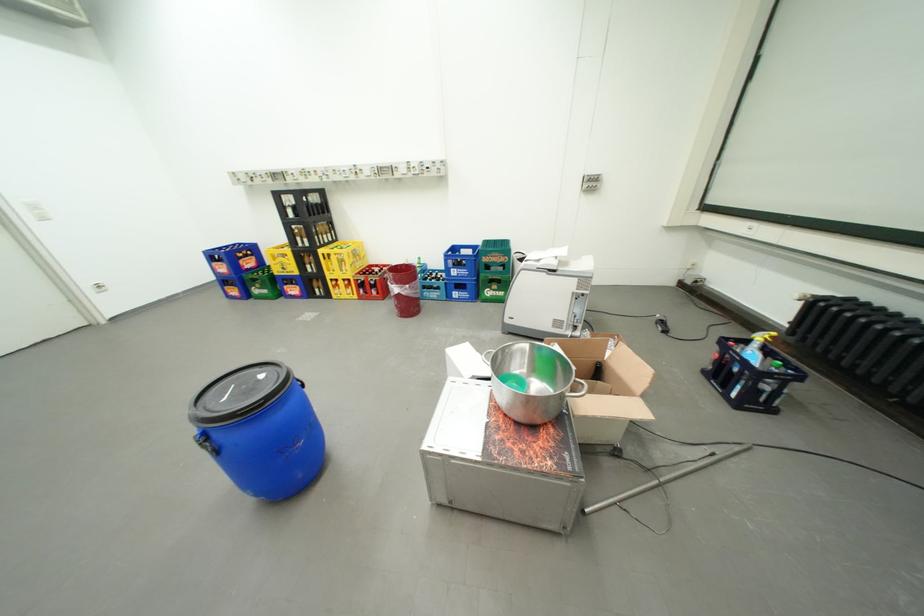
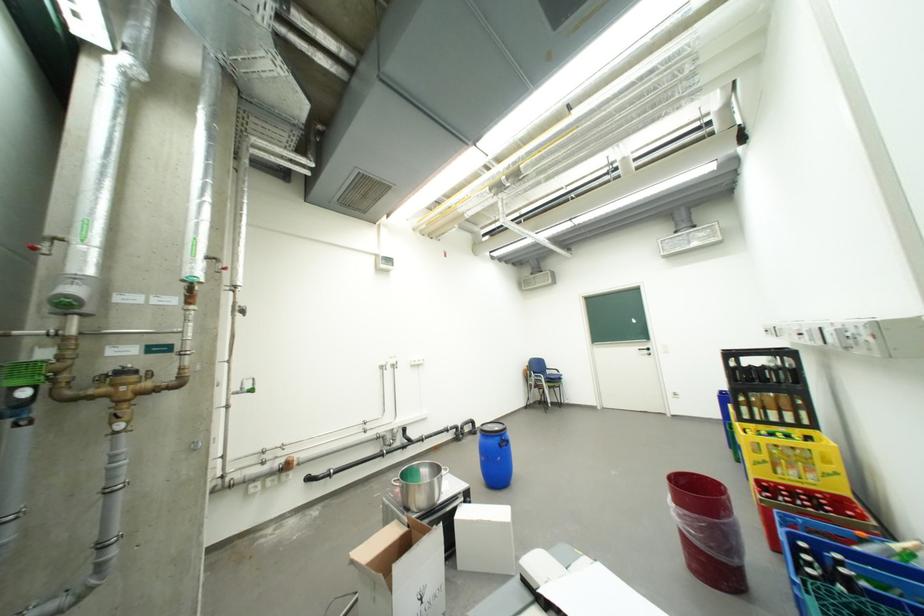
Question: I am providing you with two images of the same scene from different viewpoints. Please identify which objects are invisible in image2.

Choices:
 (A) silver door handle
 (B) pot handle
 (C) white box
 (D) none of these

Answer: (D)